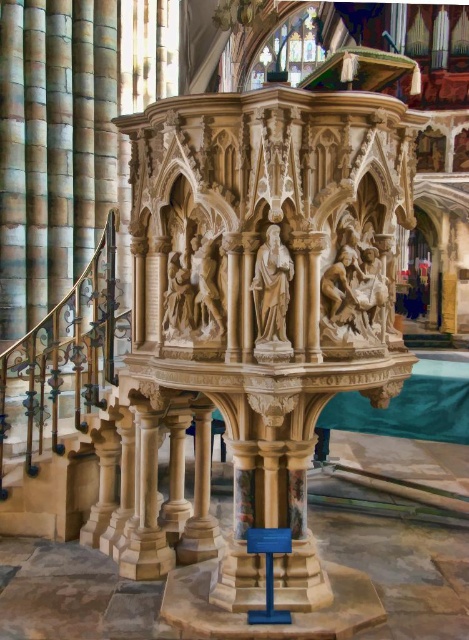
Consider the image. You are an art conservator tasked with measuring the space between two central artworks in the cathedral. The polished stone relief at center and the white marble statue at center are both located in the same area. Can you confirm if there is enough space between them to safely place a 16.5 inch wide protective barrier?

The distance between the polished stone relief at center and the white marble statue at center is 17.40 inches. Since the protective barrier is 16.5 inches wide, there is sufficient space to place it between them as 17.40 inches is greater than 16.5 inches.

You are an art historian examining the cathedral interior. You notice the polished stone relief at center and the white marble statue at center. Which object is located to the right of the other?

The polished stone relief at center is positioned on the right side of white marble statue at center.